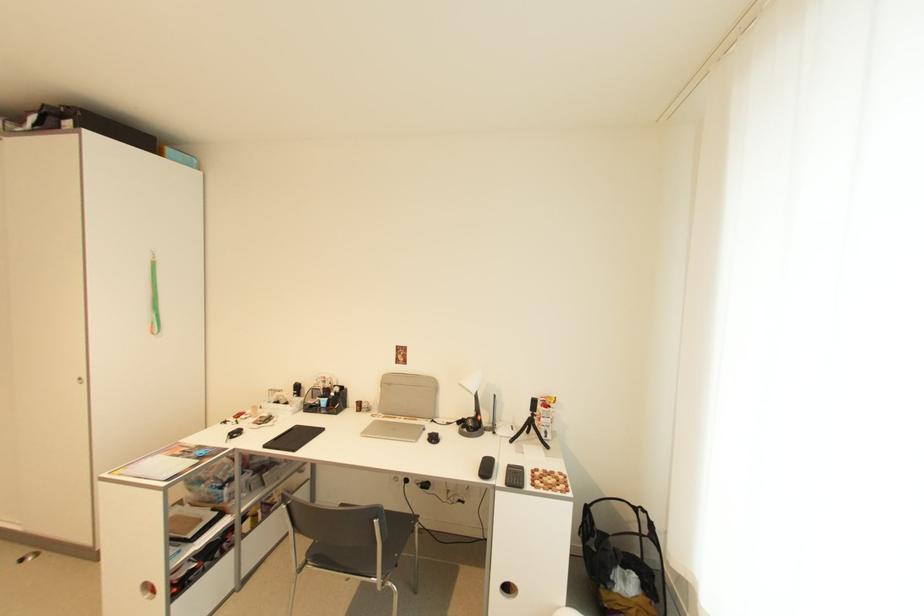
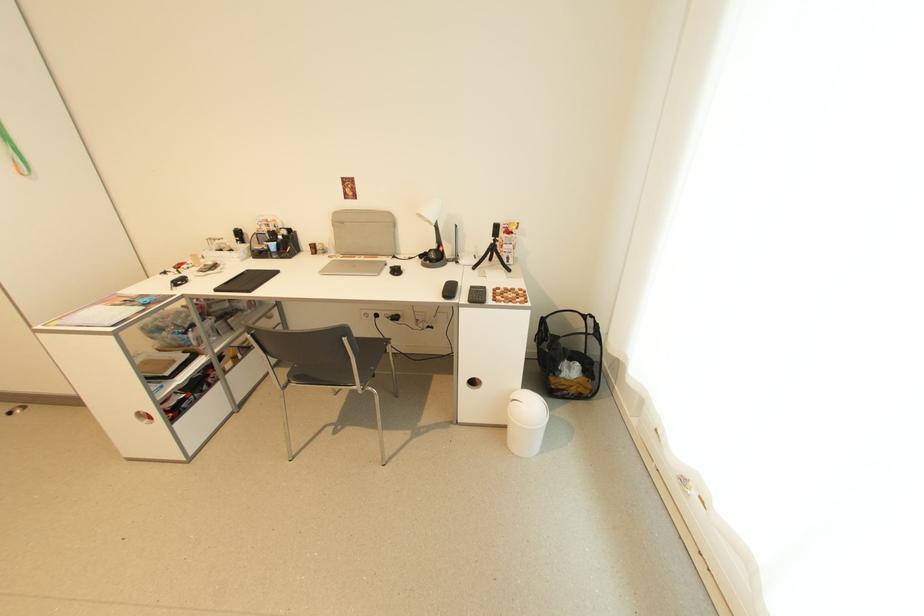
In the second image, find the point that corresponds to [395,386] in the first image.

(347, 224)